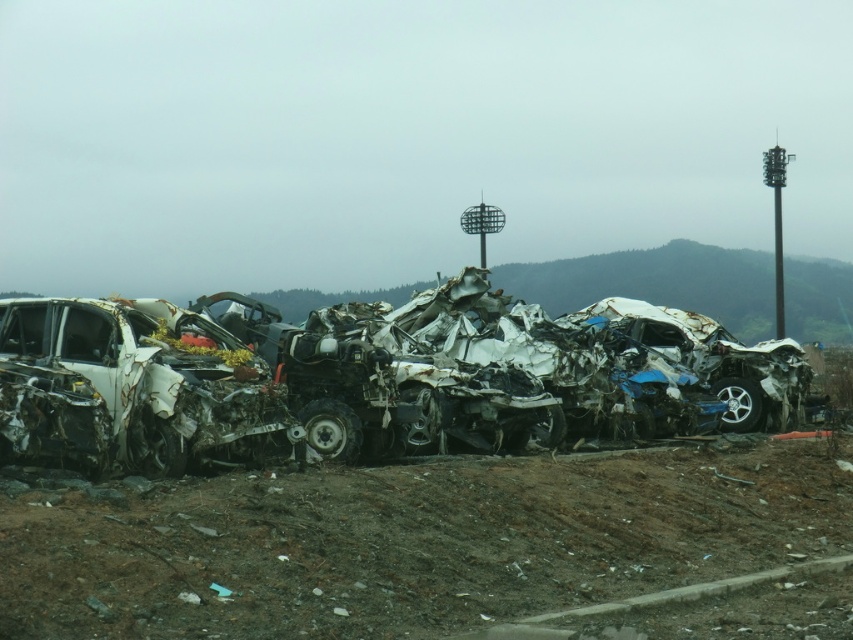
Question: Among these points, which one is farthest from the camera?

Choices:
 (A) (801, 403)
 (B) (294, 422)

Answer: (A)

Question: Is rusty metal wreck at center thinner than rusty metal car at left?

Choices:
 (A) no
 (B) yes

Answer: (A)

Question: Where is rusty metal wreck at center located in relation to rusty metal car at left in the image?

Choices:
 (A) below
 (B) above

Answer: (B)

Question: Where is rusty metal wreck at center located in relation to rusty metal car at left in the image?

Choices:
 (A) right
 (B) left

Answer: (A)